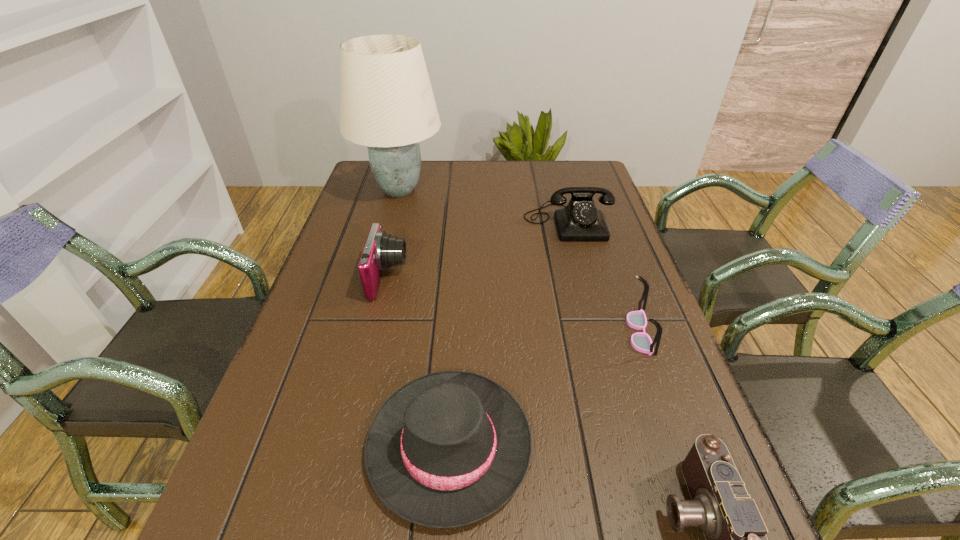
Image resolution: width=960 pixels, height=540 pixels. Identify the location of lampshade. (386, 100).

Identify the location of the left camera. (381, 250).

Find the location of a particular element. The width and height of the screenshot is (960, 540). the taller camera is located at coordinates (381, 250).

Image resolution: width=960 pixels, height=540 pixels. Identify the location of telephone. (580, 220).

This screenshot has width=960, height=540. I want to click on the fourth farthest object, so click(641, 341).

At what (x,y) coordinates should I click in order to perform the action: click on dress hat. Please return your answer as a coordinate pair (x, y). Image resolution: width=960 pixels, height=540 pixels. Looking at the image, I should click on (446, 450).

Where is `free region located on the right of the tallest object`? Image resolution: width=960 pixels, height=540 pixels. free region located on the right of the tallest object is located at coordinates (522, 191).

Locate an element on the screen. This screenshot has width=960, height=540. free spot located on the front-facing side of the taller camera is located at coordinates pos(497,278).

The height and width of the screenshot is (540, 960). In order to click on vacant space located on the front face of the telephone in this screenshot , I will do point(599,338).

Locate an element on the screen. This screenshot has width=960, height=540. vacant space positioned 0.340m on the front of the spectacles is located at coordinates pos(712,533).